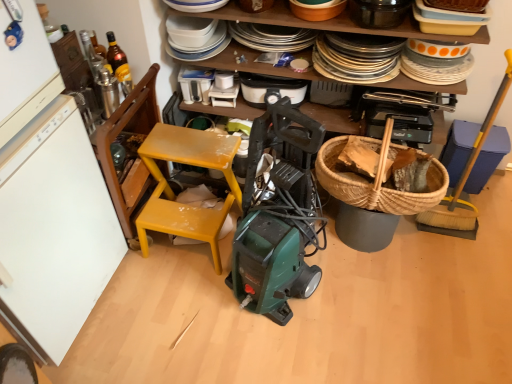
At what (x,y) coordinates should I click in order to perform the action: click on vacant point above yellow matte chair at center (from a real-world perspective). Please return your answer as a coordinate pair (x, y). This screenshot has width=512, height=384. Looking at the image, I should click on (188, 148).